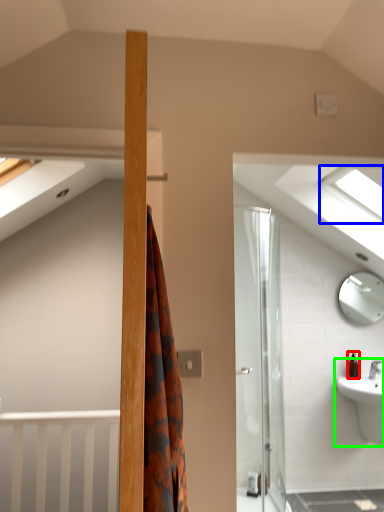
Question: Which is farther away from toiletry (highlighted by a red box)? window (highlighted by a blue box) or sink (highlighted by a green box)?

Choices:
 (A) window
 (B) sink

Answer: (A)